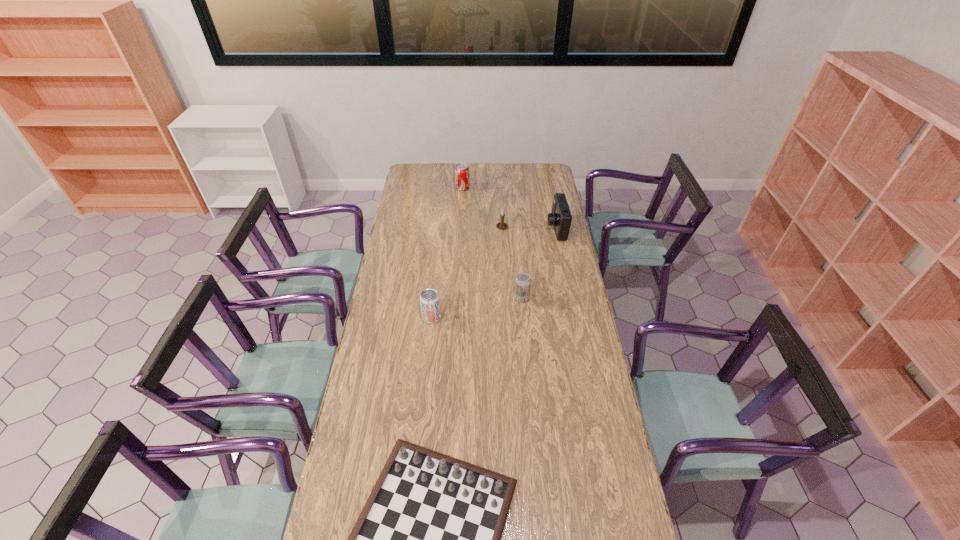
Where is `blank region between the candle holder and the leftmost soda can`? blank region between the candle holder and the leftmost soda can is located at coordinates (467, 273).

The image size is (960, 540). What are the coordinates of `free point between the second soda can from right to left and the candle holder` in the screenshot? It's located at (482, 208).

Where is `vacant point located between the candle holder and the farthest object`? Image resolution: width=960 pixels, height=540 pixels. vacant point located between the candle holder and the farthest object is located at coordinates (482, 208).

Image resolution: width=960 pixels, height=540 pixels. I want to click on vacant region between the candle holder and the rightmost soda can, so click(512, 263).

This screenshot has width=960, height=540. I want to click on free space between the farthest object and the second nearest object, so (x=447, y=253).

I want to click on empty space that is in between the second farthest soda can and the farthest soda can, so click(492, 243).

Select which object appears as the fifth closest to the farthest object. Please provide its 2D coordinates. Your answer should be formatted as a tuple, i.e. [(x, y)], where the tuple contains the x and y coordinates of a point satisfying the conditions above.

[(428, 539)]

The width and height of the screenshot is (960, 540). I want to click on object that is the fourth closest to the nearest soda can, so [x=560, y=217].

Where is `soda can that is the second nearest to the fifth farthest object`? This screenshot has width=960, height=540. soda can that is the second nearest to the fifth farthest object is located at coordinates (462, 176).

At what (x,y) coordinates should I click in order to perform the action: click on soda can that can be found as the closest to the farthest soda can. Please return your answer as a coordinate pair (x, y). This screenshot has width=960, height=540. Looking at the image, I should click on (523, 281).